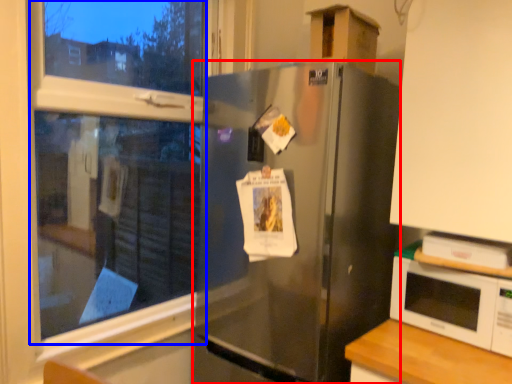
Question: Among these objects, which one is farthest to the camera, refrigerator (highlighted by a red box) or bay window (highlighted by a blue box)?

Choices:
 (A) refrigerator
 (B) bay window

Answer: (A)